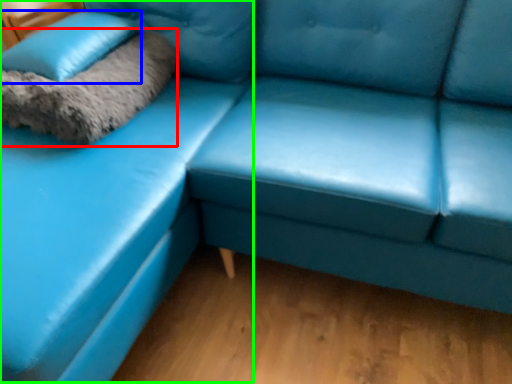
Question: Estimate the real-world distances between objects in this image. Which object is closer to blanket (highlighted by a red box), pillow (highlighted by a blue box) or couch (highlighted by a green box)?

Choices:
 (A) pillow
 (B) couch

Answer: (A)